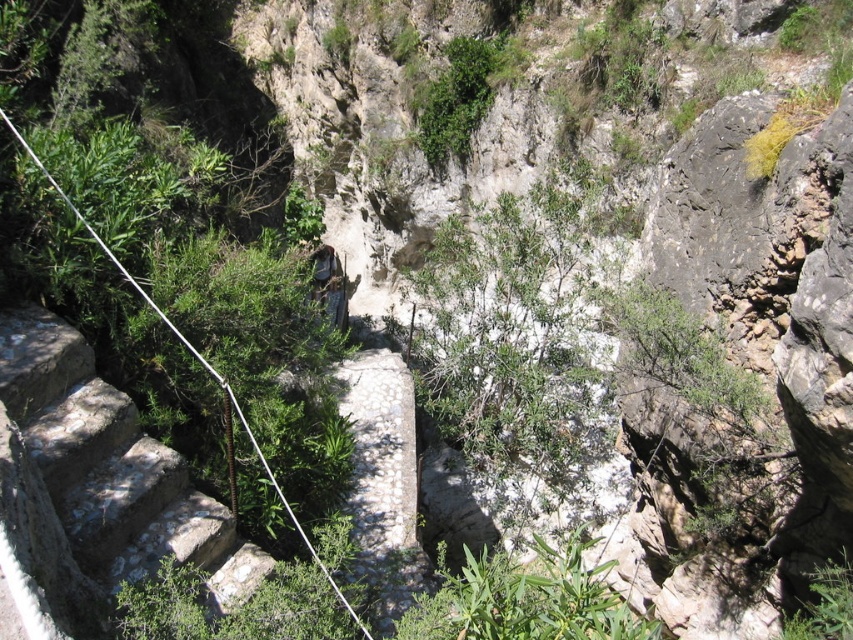
Question: Can you confirm if stone stairs at left is bigger than green leafy bush at upper center?

Choices:
 (A) no
 (B) yes

Answer: (A)

Question: Which point appears closest to the camera in this image?

Choices:
 (A) (454, 144)
 (B) (160, 547)

Answer: (B)

Question: Is stone stairs at left positioned in front of green leafy bush at upper center?

Choices:
 (A) yes
 (B) no

Answer: (A)

Question: Among these points, which one is nearest to the camera?

Choices:
 (A) (84, 353)
 (B) (438, 104)

Answer: (A)

Question: Is the position of stone stairs at left more distant than that of green leafy bush at upper center?

Choices:
 (A) no
 (B) yes

Answer: (A)